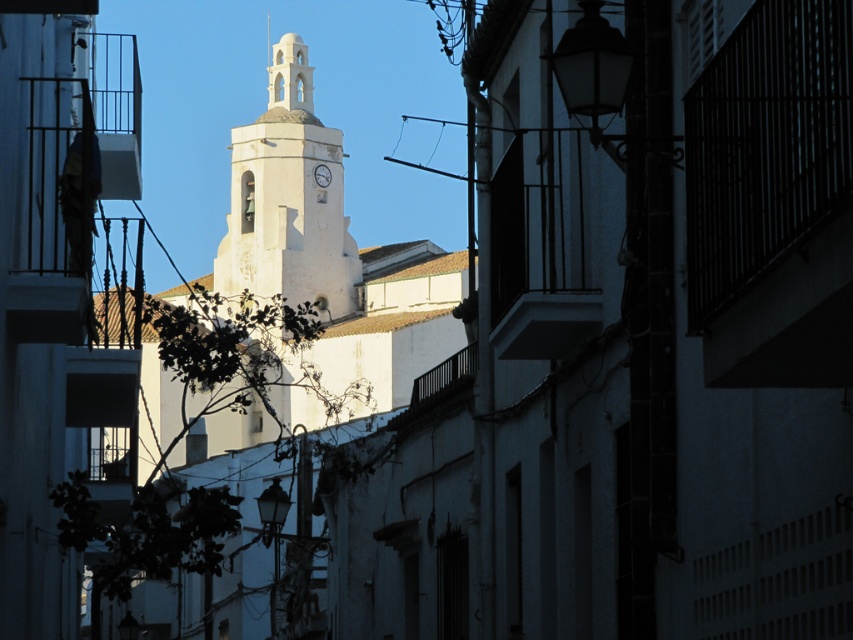
Does point (326, 301) come closer to viewer compared to point (317, 168)?

Yes, it is in front of point (317, 168).

Is point (326, 216) more distant than point (317, 180)?

No.

This screenshot has width=853, height=640. I want to click on white stucco bell tower at center, so click(288, 198).